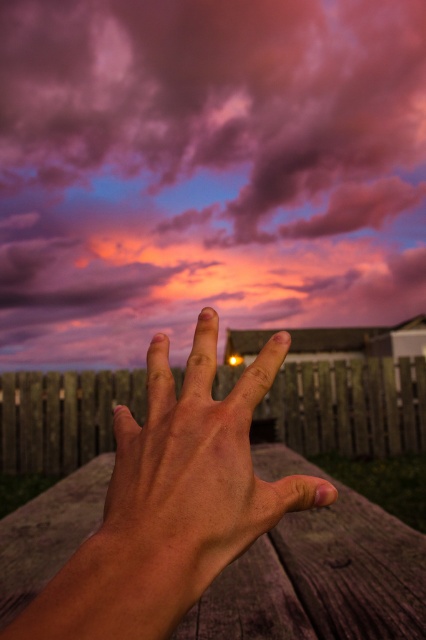
You are planning to host a picnic under the pink cotton candy cloud at upper center and the wooden picnic table at center. Based on their sizes, which object would provide more shade?

The pink cotton candy cloud at upper center would provide more shade because its width is larger than the wooden picnic table at center.

You are planning to have a picnic and need to place a large basket on the wooden picnic table at center. Considering the size of the smooth skin hand at center, can the basket fit on the table?

The wooden picnic table at center has a larger size compared to the smooth skin hand at center, so the basket should fit comfortably on the table.

You are standing in front of the scene and want to take a photo of the wooden picnic table at center without the pink cotton candy cloud at upper center blocking it. How should you adjust your position?

The pink cotton candy cloud at upper center is in front of the wooden picnic table at center, so you should move your position to the side or lower your camera angle to avoid the cloud blocking the table.